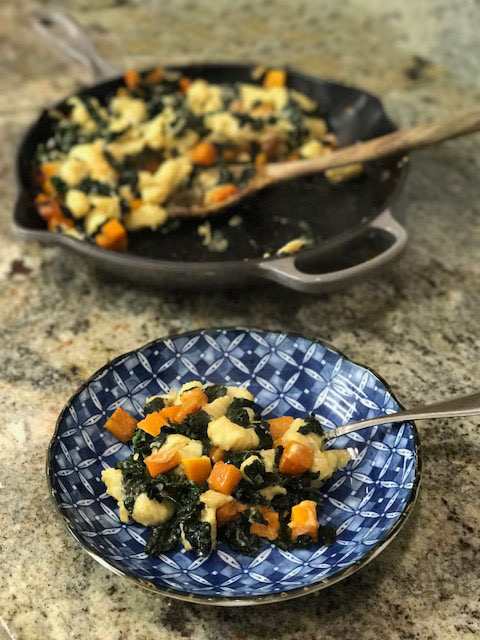
This screenshot has width=480, height=640. In order to click on blue and white plate in this screenshot , I will do `click(183, 573)`.